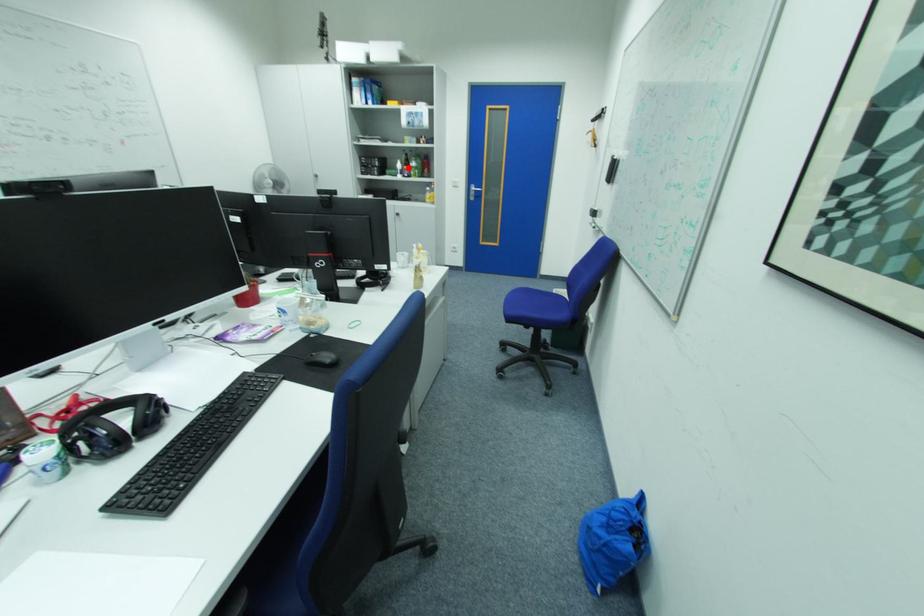
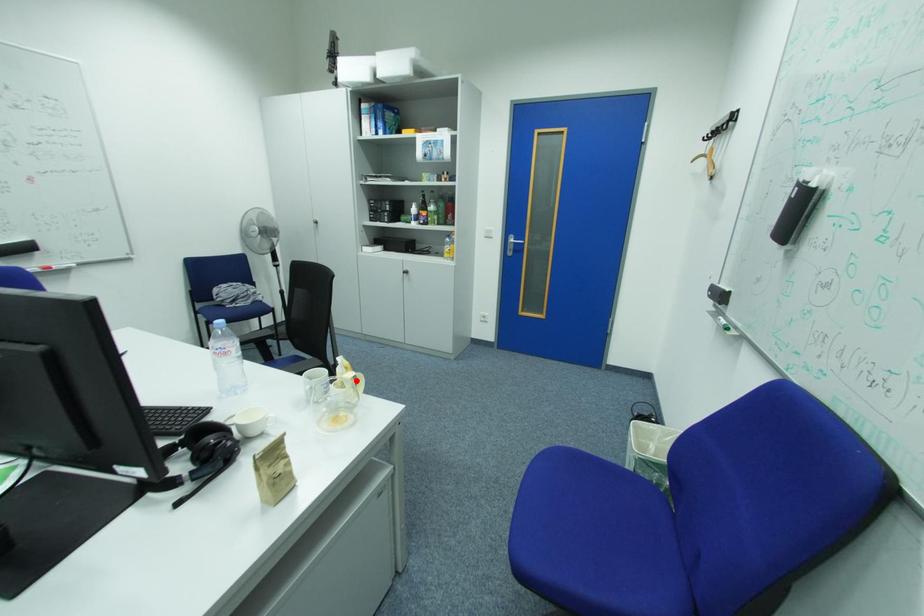
I am providing you with two images of the same scene from different viewpoints. A red point is marked on the first image and another point is marked on the second image. Do the highlighted points in image1 and image2 indicate the same real-world spot?

No